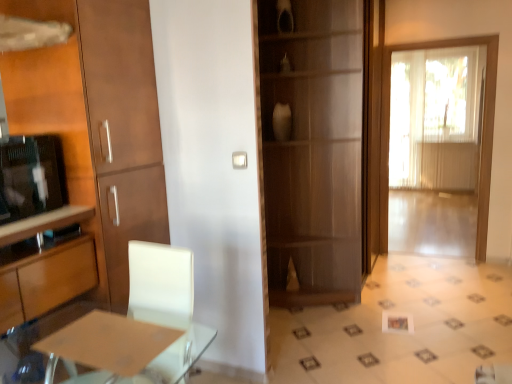
Question: Should I look upward or downward to see white sheer curtain at right?

Choices:
 (A) up
 (B) down

Answer: (A)

Question: Could you tell me if wooden cabinet at center is facing transparent glass door at right?

Choices:
 (A) yes
 (B) no

Answer: (A)

Question: Could transparent glass door at right be considered to be inside wooden cabinet at center?

Choices:
 (A) yes
 (B) no

Answer: (B)

Question: Is wooden cabinet at center smaller than transparent glass door at right?

Choices:
 (A) no
 (B) yes

Answer: (A)

Question: From the image's perspective, is wooden cabinet at center under transparent glass door at right?

Choices:
 (A) no
 (B) yes

Answer: (A)

Question: Can you confirm if wooden cabinet at center is taller than transparent glass door at right?

Choices:
 (A) no
 (B) yes

Answer: (B)

Question: Are wooden cabinet at center and transparent glass door at right far apart?

Choices:
 (A) no
 (B) yes

Answer: (B)

Question: Considering the relative sizes of matte brown table at lower left and white sheer curtain at right in the image provided, is matte brown table at lower left bigger than white sheer curtain at right?

Choices:
 (A) no
 (B) yes

Answer: (A)

Question: Considering the relative positions of matte brown table at lower left and white sheer curtain at right in the image provided, is matte brown table at lower left to the right of white sheer curtain at right from the viewer's perspective?

Choices:
 (A) no
 (B) yes

Answer: (A)

Question: From a real-world perspective, is matte brown table at lower left located higher than white sheer curtain at right?

Choices:
 (A) yes
 (B) no

Answer: (B)

Question: Considering the relative sizes of matte brown table at lower left and white sheer curtain at right in the image provided, is matte brown table at lower left wider than white sheer curtain at right?

Choices:
 (A) yes
 (B) no

Answer: (A)

Question: Can white sheer curtain at right be found inside matte brown table at lower left?

Choices:
 (A) yes
 (B) no

Answer: (B)

Question: From the image's perspective, would you say matte brown table at lower left is shown under white sheer curtain at right?

Choices:
 (A) yes
 (B) no

Answer: (A)

Question: Can you confirm if matte brown table at lower left is thinner than wooden cabinet at left, positioned as the second cabinetry in top-to-bottom order?

Choices:
 (A) yes
 (B) no

Answer: (A)